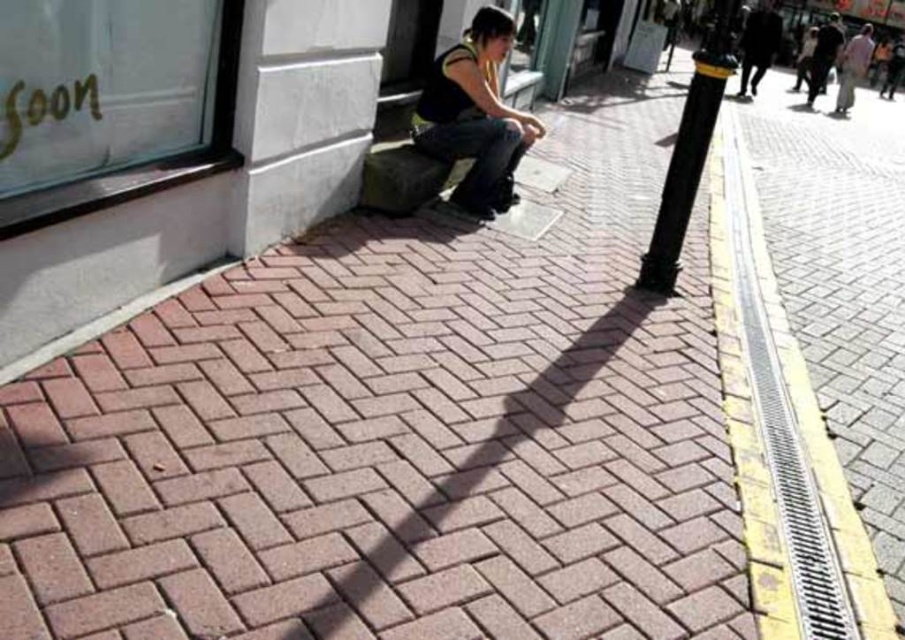
Is denim jeans at center wider than dark gray jacket at upper right?

In fact, denim jeans at center might be narrower than dark gray jacket at upper right.

Is denim jeans at center to the right of dark gray jacket at upper right from the viewer's perspective?

No, denim jeans at center is not to the right of dark gray jacket at upper right.

At what (x,y) coordinates should I click in order to perform the action: click on denim jeans at center. Please return your answer as a coordinate pair (x, y). The image size is (905, 640). Looking at the image, I should click on (475, 115).

Identify the location of dark fabric jacket at upper right. (758, 44).

Which is behind, point (749, 33) or point (837, 13)?

Point (837, 13)

Which is in front, point (769, 35) or point (826, 67)?

Point (769, 35) is more forward.

Where is `dark fabric jacket at upper right`? This screenshot has height=640, width=905. dark fabric jacket at upper right is located at coordinates (758, 44).

Does dark fabric jacket at upper right have a lesser height compared to light brown fabric pants at right?

Indeed, dark fabric jacket at upper right has a lesser height compared to light brown fabric pants at right.

Does dark fabric jacket at upper right have a greater height compared to light brown fabric pants at right?

In fact, dark fabric jacket at upper right may be shorter than light brown fabric pants at right.

Who is more forward, (756, 52) or (859, 36)?

Point (756, 52) is in front.

This screenshot has height=640, width=905. Identify the location of dark fabric jacket at upper right. (758, 44).